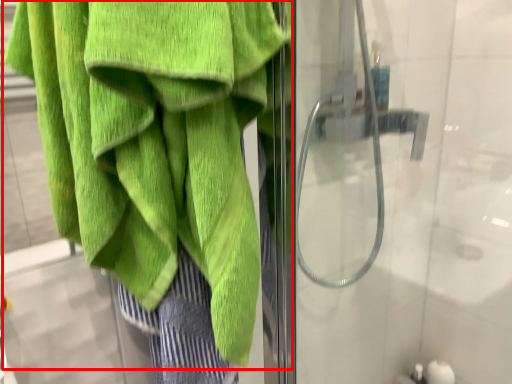
Question: From the image's perspective, where is towel (annotated by the red box) located in relation to screen door in the image?

Choices:
 (A) above
 (B) below

Answer: (B)